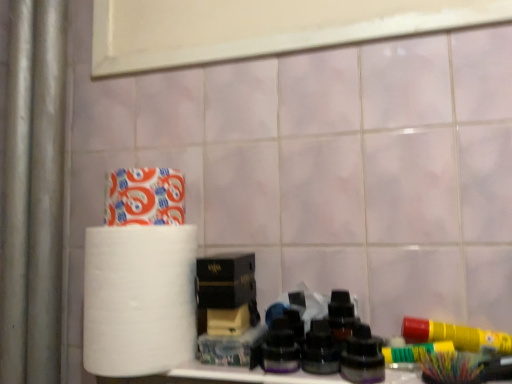
Question: Is black matte box at center surrounded by white matte toilet paper at upper left?

Choices:
 (A) yes
 (B) no

Answer: (B)

Question: Considering the relative sizes of white matte toilet paper at upper left and black matte box at center in the image provided, is white matte toilet paper at upper left thinner than black matte box at center?

Choices:
 (A) yes
 (B) no

Answer: (B)

Question: From a real-world perspective, is white matte toilet paper at upper left beneath black matte box at center?

Choices:
 (A) no
 (B) yes

Answer: (A)

Question: Is the depth of white matte toilet paper at upper left greater than that of black matte box at center?

Choices:
 (A) yes
 (B) no

Answer: (B)

Question: Does white matte toilet paper at upper left turn towards black matte box at center?

Choices:
 (A) no
 (B) yes

Answer: (A)

Question: Does white matte toilet paper at upper left have a greater height compared to black matte box at center?

Choices:
 (A) yes
 (B) no

Answer: (A)

Question: Does white matte paper towel at left have a smaller size compared to black matte box at center?

Choices:
 (A) yes
 (B) no

Answer: (B)

Question: Does white matte paper towel at left appear on the right side of black matte box at center?

Choices:
 (A) no
 (B) yes

Answer: (A)

Question: Is white matte paper towel at left beside black matte box at center?

Choices:
 (A) yes
 (B) no

Answer: (A)

Question: From the image's perspective, is white matte paper towel at left above black matte box at center?

Choices:
 (A) yes
 (B) no

Answer: (B)

Question: Is white matte paper towel at left surrounding black matte box at center?

Choices:
 (A) no
 (B) yes

Answer: (A)

Question: Is white matte paper towel at left positioned behind black matte box at center?

Choices:
 (A) no
 (B) yes

Answer: (A)

Question: From a real-world perspective, is black matte box at center under white matte paper towel at left?

Choices:
 (A) yes
 (B) no

Answer: (B)